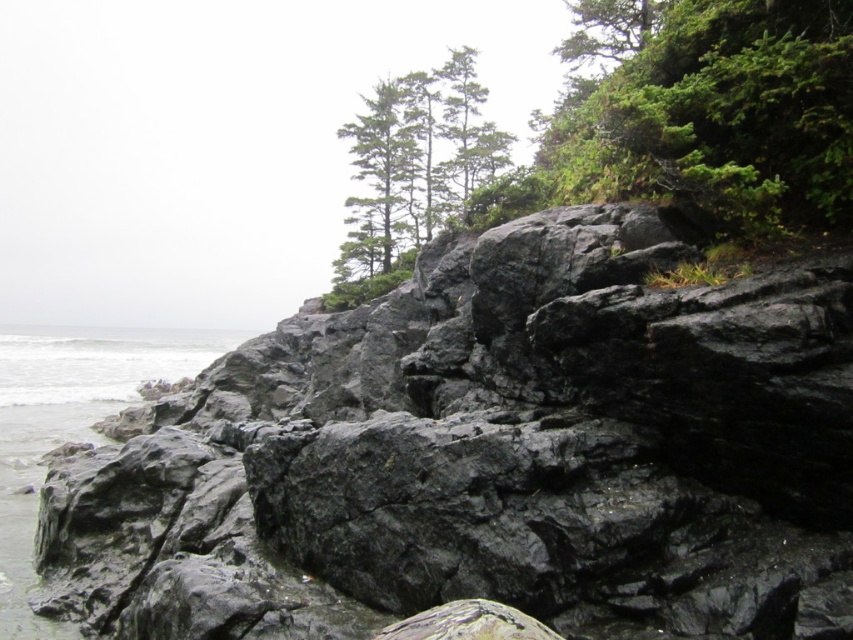
Question: Which object appears closest to the camera in this image?

Choices:
 (A) gray rock at lower left
 (B) green leafy tree at upper right
 (C) green matte tree at upper center

Answer: (B)

Question: Can you confirm if green leafy tree at upper right is thinner than green matte tree at upper center?

Choices:
 (A) yes
 (B) no

Answer: (A)

Question: Observing the image, what is the correct spatial positioning of green leafy tree at upper right in reference to gray rock at lower left?

Choices:
 (A) above
 (B) below

Answer: (A)

Question: Which point is closer to the camera?

Choices:
 (A) green leafy tree at upper right
 (B) black rough rock at center
 (C) green matte tree at upper center
 (D) gray rock at lower left

Answer: (B)

Question: Can you confirm if gray rock at lower left is positioned to the right of green matte tree at upper center?

Choices:
 (A) no
 (B) yes

Answer: (A)

Question: Which of these objects is positioned closest to the green leafy tree at upper right?

Choices:
 (A) green matte tree at upper center
 (B) black rough rock at center
 (C) gray rock at lower left

Answer: (B)